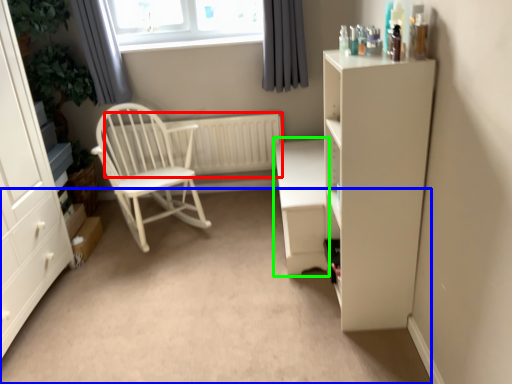
Question: Estimate the real-world distances between objects in this image. Which object is closer to radiator (highlighted by a red box), plain (highlighted by a blue box) or table (highlighted by a green box)?

Choices:
 (A) plain
 (B) table

Answer: (B)